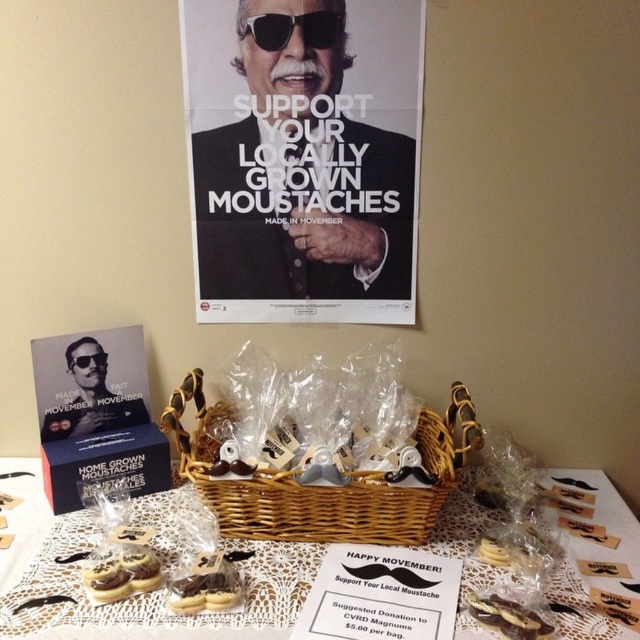
Question: Is white lace tablecloth at center positioned at the back of woven brown basket at center?

Choices:
 (A) yes
 (B) no

Answer: (B)

Question: In this image, where is satin black poster at upper center located relative to chocolate-coated biscuit at center?

Choices:
 (A) below
 (B) above

Answer: (B)

Question: Which is nearer to the chocolate-coated cookies at lower left?

Choices:
 (A) white lace tablecloth at center
 (B) satin black poster at upper center
 (C) chocolate-coated biscuit at center
 (D) chocolate-coated cookies at center

Answer: (D)

Question: Estimate the real-world distances between objects in this image. Which object is farther from the chocolate-coated cookies at lower left?

Choices:
 (A) matte black suit at upper center
 (B) woven brown basket at center
 (C) black plastic sunglasses at upper center

Answer: (C)

Question: Is woven brown basket at center smaller than satin black poster at upper center?

Choices:
 (A) no
 (B) yes

Answer: (A)

Question: Which point is farther from the camera taking this photo?

Choices:
 (A) (182, 433)
 (B) (246, 20)
 (C) (112, 406)
 (D) (97, 577)

Answer: (C)